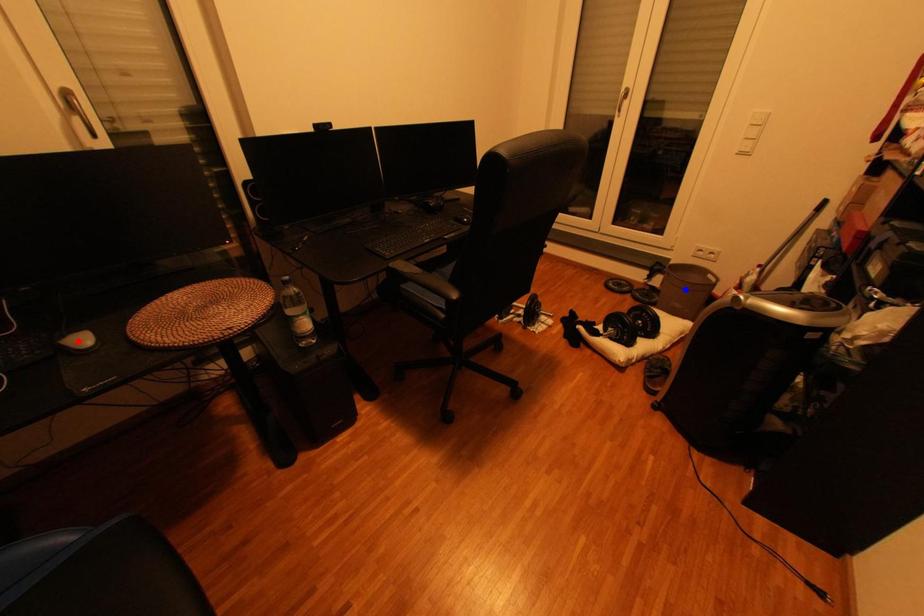
Question: In the image, two points are highlighted. Which point is nearer to the camera? Reply with the corresponding letter.

Choices:
 (A) blue point
 (B) red point

Answer: (B)